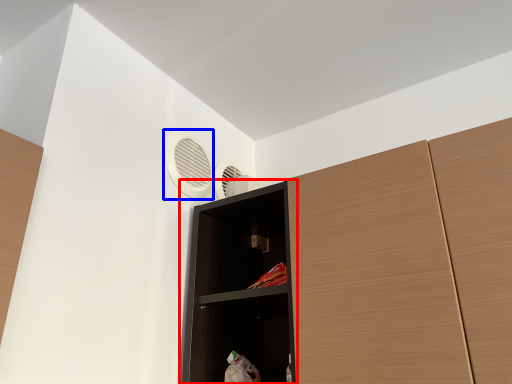
Question: Which object appears farthest to the camera in this image, shelf (highlighted by a red box) or air conditioning (highlighted by a blue box)?

Choices:
 (A) shelf
 (B) air conditioning

Answer: (B)